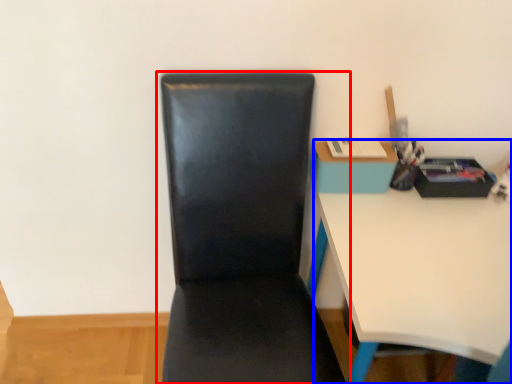
Question: Among these objects, which one is nearest to the camera, chair (highlighted by a red box) or desk (highlighted by a blue box)?

Choices:
 (A) chair
 (B) desk

Answer: (A)